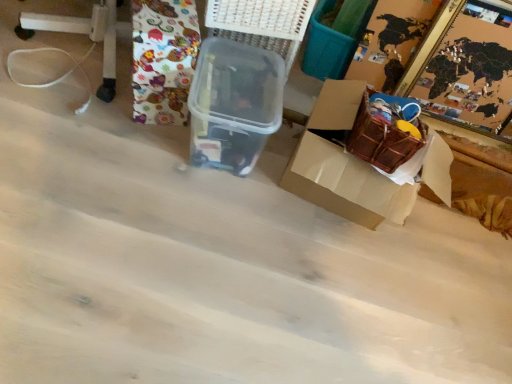
Question: Considering the positions of point (294, 18) and point (146, 97), is point (294, 18) closer or farther from the camera than point (146, 97)?

Choices:
 (A) closer
 (B) farther

Answer: (A)

Question: Considering the relative positions of white plastic basket at upper center and patterned fabric at upper left in the image provided, is white plastic basket at upper center to the left or to the right of patterned fabric at upper left?

Choices:
 (A) right
 (B) left

Answer: (A)

Question: Which object is the closest to the brown cardboard box at lower right?

Choices:
 (A) wooden puzzle frame at upper right
 (B) patterned fabric at upper left
 (C) transparent plastic container at center
 (D) white plastic basket at upper center

Answer: (C)

Question: Which object is positioned closest to the white plastic basket at upper center?

Choices:
 (A) brown cardboard box at lower right
 (B) transparent plastic container at center
 (C) wooden puzzle frame at upper right
 (D) patterned fabric at upper left

Answer: (B)